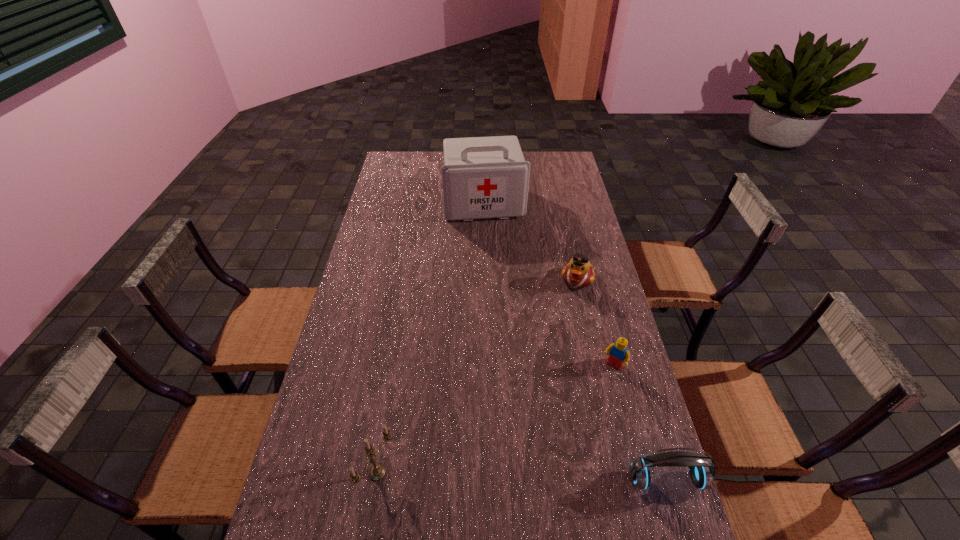
Image resolution: width=960 pixels, height=540 pixels. I want to click on candle, so click(377, 472).

Where is `the leftmost object`? the leftmost object is located at coordinates (377, 472).

Locate an element on the screen. headset is located at coordinates (701, 468).

This screenshot has height=540, width=960. What are the coordinates of `the farthest object` in the screenshot? It's located at [x=483, y=177].

Locate an element on the screen. The image size is (960, 540). the tallest object is located at coordinates (483, 177).

Where is `the third farthest object`? the third farthest object is located at coordinates (618, 353).

This screenshot has height=540, width=960. In order to click on the second farthest object in this screenshot , I will do `click(578, 273)`.

Where is `vacant space situated on the back of the candle`? vacant space situated on the back of the candle is located at coordinates (398, 344).

This screenshot has height=540, width=960. I want to click on vacant space located on the ear cups of the headset, so click(680, 527).

Identify the location of vacant area situated 0.390m on the front-facing side of the farthest object. The image size is (960, 540). (501, 292).